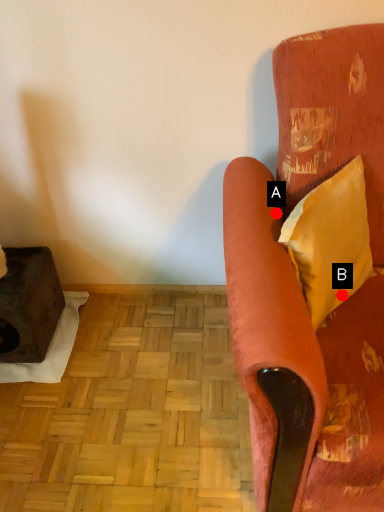
Question: Two points are circled on the image, labeled by A and B beside each circle. Which point is farther from the camera taking this photo?

Choices:
 (A) A is further
 (B) B is further

Answer: (B)